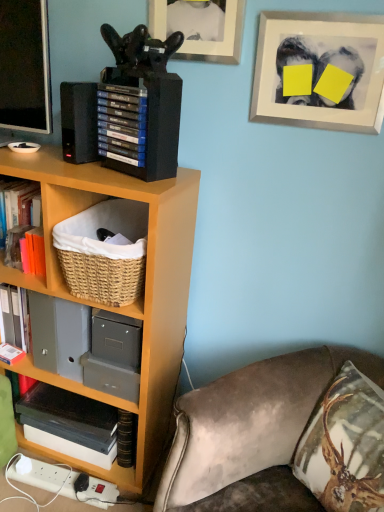
You are a GUI agent. You are given a task and a screenshot of the screen. Output one action in this format:
    pyautogui.click(x=<x>, y=<y>)
    Task: Click on the black plastic speaker at upper left
    Image resolution: width=384 pixels, height=512 pixels.
    Given the screenshot: What is the action you would take?
    pyautogui.click(x=79, y=122)

This screenshot has width=384, height=512. Find the location of `matte black picture frame at upper center, the second picture frame positioned from the right`. matte black picture frame at upper center, the second picture frame positioned from the right is located at coordinates (223, 40).

You are a GUI agent. You are given a task and a screenshot of the screen. Output one action in this format:
    pyautogui.click(x=<x>, y=<y>)
    Task: Click on the black glossy speaker at upper left
    The image size is (384, 512).
    Given the screenshot: What is the action you would take?
    pyautogui.click(x=25, y=66)

Measure the distance between point (113, 207) and camera.

A distance of 4.73 feet exists between point (113, 207) and camera.

You are a GUI agent. You are given a task and a screenshot of the screen. Output one action in this format:
    pyautogui.click(x=<x>, y=<y>)
    Task: Click on the blue matte game cases at upper left
    Image resolution: width=384 pixels, height=512 pixels.
    Given the screenshot: What is the action you would take?
    (122, 123)

Based on their sizes in the image, would you say black plastic speaker at upper left is bigger or smaller than velvet brown couch at lower right?

Considering their sizes, black plastic speaker at upper left takes up less space than velvet brown couch at lower right.

How far apart are black plastic speaker at upper left and velvet brown couch at lower right?

33.54 inches.

Does black plastic speaker at upper left lie behind velvet brown couch at lower right?

Yes, black plastic speaker at upper left is further from the camera.

Does point (368, 478) appear closer or farther from the camera than point (115, 442)?

Clearly, point (368, 478) is closer to the camera than point (115, 442).

From the image's perspective, is velvet brown pillow with deer print at lower right located above or below black matte book at lower left?

From the image's perspective, velvet brown pillow with deer print at lower right appears above black matte book at lower left.

In terms of width, does velvet brown pillow with deer print at lower right look wider or thinner when compared to black matte book at lower left?

velvet brown pillow with deer print at lower right is wider than black matte book at lower left.

Is velvet brown pillow with deer print at lower right situated inside black matte book at lower left or outside?

The correct answer is: outside.

Could you tell me if woven natural basket at lower left is turned towards wooden bookcase at left?

Yes, woven natural basket at lower left is facing wooden bookcase at left.

Considering the positions of points (71, 220) and (57, 166), is point (71, 220) farther from camera compared to point (57, 166)?

Yes, point (71, 220) is behind point (57, 166).

Considering the relative sizes of woven natural basket at lower left and wooden bookcase at left in the image provided, is woven natural basket at lower left shorter than wooden bookcase at left?

Correct, woven natural basket at lower left is not as tall as wooden bookcase at left.

Considering the positions of objects woven natural basket at lower left and wooden bookcase at left in the image provided, who is more to the left, woven natural basket at lower left or wooden bookcase at left?

Positioned to the left is wooden bookcase at left.

Is blue matte game cases at upper left turned away from matte black picture frame at upper center, the second picture frame positioned from the right?

No, blue matte game cases at upper left is not facing away from matte black picture frame at upper center, the second picture frame positioned from the right.

At what (x,y) coordinates should I click in order to perform the action: click on book to the left of matte black picture frame at upper center, which is counted as the 1th picture frame, starting from the left. Please return your answer as a coordinate pair (x, y). Looking at the image, I should click on pos(122,123).

From a real-world perspective, is blue matte game cases at upper left below matte black picture frame at upper center, the second picture frame positioned from the right?

Indeed, from a real-world perspective, blue matte game cases at upper left is positioned beneath matte black picture frame at upper center, the second picture frame positioned from the right.

From the image's perspective, is velvet brown couch at lower right located above or below black matte book at lower left?

velvet brown couch at lower right is below black matte book at lower left.

Based on the photo, considering the relative positions of velvet brown couch at lower right and black matte book at lower left in the image provided, is velvet brown couch at lower right to the right of black matte book at lower left from the viewer's perspective?

Correct, you'll find velvet brown couch at lower right to the right of black matte book at lower left.

Can you tell me how much velvet brown couch at lower right and black matte book at lower left differ in facing direction?

36.8 degrees separate the facing orientations of velvet brown couch at lower right and black matte book at lower left.

Is velvet brown couch at lower right outside of black matte book at lower left?

velvet brown couch at lower right lies outside black matte book at lower left's area.

Measure the distance between woven natural basket at lower left and blue matte game cases at upper left.

The distance of woven natural basket at lower left from blue matte game cases at upper left is 29.83 centimeters.

I want to click on basket located behind the blue matte game cases at upper left, so click(104, 252).

From the picture: Is woven natural basket at lower left directly adjacent to blue matte game cases at upper left?

No, woven natural basket at lower left is not next to blue matte game cases at upper left.

Looking at this image, between woven natural basket at lower left and blue matte game cases at upper left, which one has smaller size?

Smaller between the two is blue matte game cases at upper left.

Does wooden bookcase at left contain black plastic speaker at upper left?

No, black plastic speaker at upper left is located outside of wooden bookcase at left.

Is wooden bookcase at left to the left or to the right of black plastic speaker at upper left in the image?

Based on their positions, wooden bookcase at left is located to the left of black plastic speaker at upper left.

Looking at this image, from a real-world perspective, is wooden bookcase at left positioned under black plastic speaker at upper left based on gravity?

Yes, from a real-world perspective, wooden bookcase at left is under black plastic speaker at upper left.

Can you confirm if wooden bookcase at left is taller than black plastic speaker at upper left?

Yes.

The height and width of the screenshot is (512, 384). Identify the location of studio couch located in front of the black plastic speaker at upper left. (249, 420).

Locate an element on the screen. The width and height of the screenshot is (384, 512). paperback book on the left of velvet brown pillow with deer print at lower right is located at coordinates (69, 424).

Looking at this image, which object lies nearer to the anchor point matte black picture frame at upper center, the second picture frame positioned from the right, white plastic plug at lower left or velvet brown couch at lower right?

velvet brown couch at lower right lies closer to matte black picture frame at upper center, the second picture frame positioned from the right, than the other object.

Estimate the real-world distances between objects in this image. Which object is closer to blue matte game cases at upper left, velvet brown couch at lower right or velvet brown pillow with deer print at lower right?

velvet brown couch at lower right lies closer to blue matte game cases at upper left than the other object.

From the image, which object appears to be farther from black plastic speaker at upper left, black matte book at lower left or blue matte game cases at upper left?

black matte book at lower left lies further to black plastic speaker at upper left than the other object.

Based on their spatial positions, is velvet brown pillow with deer print at lower right or velvet brown couch at lower right further from black matte book at lower left?

Based on the image, velvet brown pillow with deer print at lower right appears to be further to black matte book at lower left.

Considering their positions, is white matte picture frame at upper right, the 1th picture frame viewed from the right, positioned closer to blue matte game cases at upper left than white plastic plug at lower left?

white matte picture frame at upper right, the 1th picture frame viewed from the right, lies closer to blue matte game cases at upper left than the other object.

Which object lies nearer to the anchor point woven natural basket at lower left, black matte book at lower left or velvet brown pillow with deer print at lower right?

Among the two, black matte book at lower left is located nearer to woven natural basket at lower left.

When comparing their distances from white matte picture frame at upper right, which is counted as the 2th picture frame, starting from the left, does blue matte game cases at upper left or velvet brown couch at lower right seem further?

Among the two, velvet brown couch at lower right is located further to white matte picture frame at upper right, which is counted as the 2th picture frame, starting from the left.

Considering their positions, is black plastic speaker at upper left positioned closer to woven natural basket at lower left than velvet brown couch at lower right?

black plastic speaker at upper left lies closer to woven natural basket at lower left than the other object.

Find the location of a particular element. This screenshot has height=512, width=384. plug between wooden bookcase at left and velvet brown couch at lower right from left to right is located at coordinates (65, 483).

You are a GUI agent. You are given a task and a screenshot of the screen. Output one action in this format:
    pyautogui.click(x=<x>, y=<y>)
    Task: Click on the basket between blue matte game cases at upper left and black matte book at lower left from top to bottom
    Image resolution: width=384 pixels, height=512 pixels.
    Given the screenshot: What is the action you would take?
    pyautogui.click(x=104, y=252)

Identify the location of television between matte black picture frame at upper center, which is counted as the 1th picture frame, starting from the left, and velvet brown couch at lower right vertically. (25, 66).

At what (x,y) coordinates should I click in order to perform the action: click on book between black glossy speaker at upper left and woven natural basket at lower left in the vertical direction. Please return your answer as a coordinate pair (x, y). Looking at the image, I should click on (122, 123).